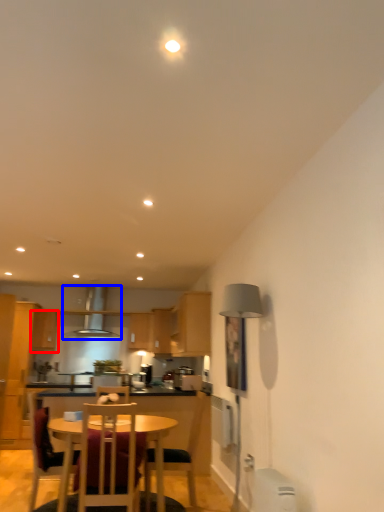
Question: Which of the following is the closest to the observer, cabinetry (highlighted by a red box) or exhaust hood (highlighted by a blue box)?

Choices:
 (A) cabinetry
 (B) exhaust hood

Answer: (A)